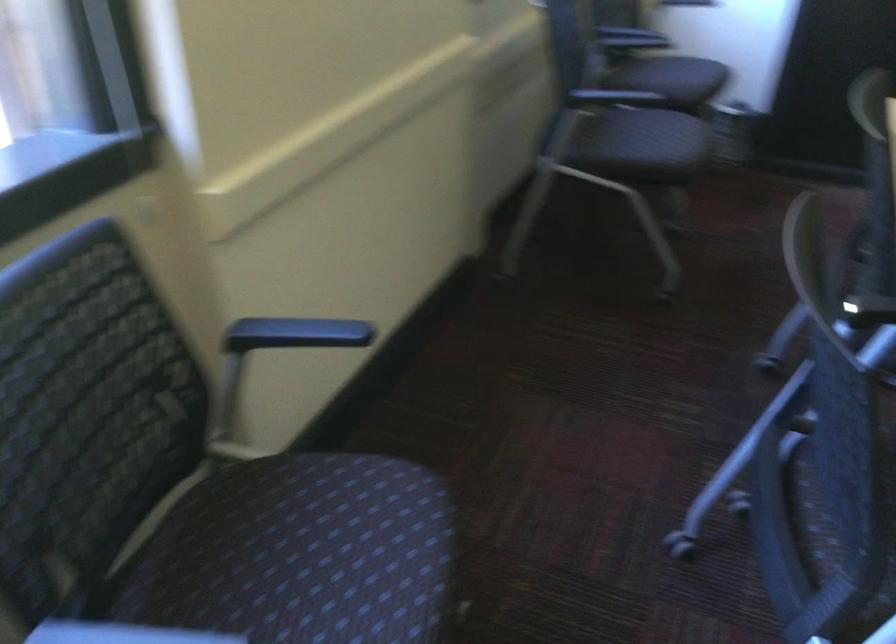
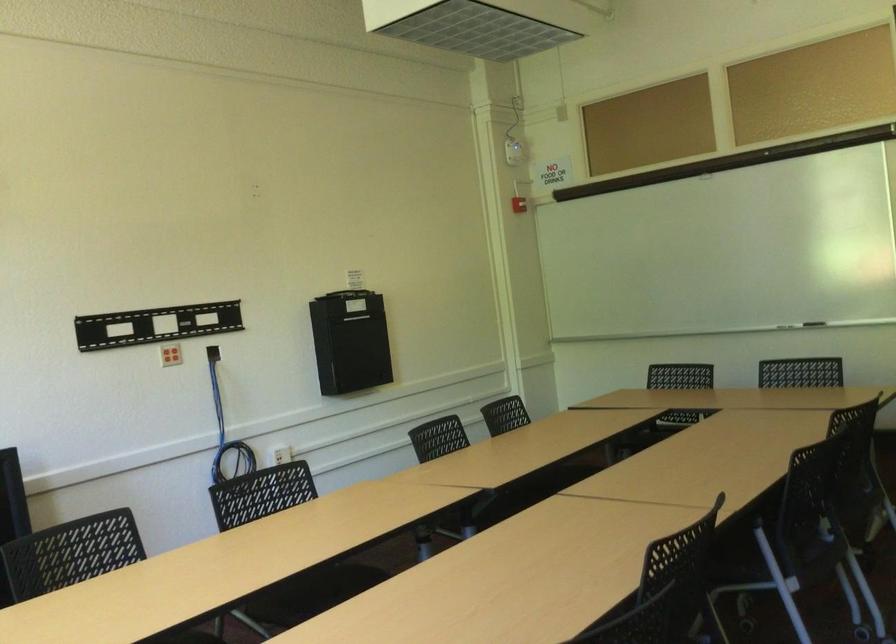
Question: The camera is either moving clockwise (left) or counter-clockwise (right) around the object. The first image is from the beginning of the video and the second image is from the end. Is the camera moving left or right when shooting the video?

Choices:
 (A) Left
 (B) Right

Answer: (A)